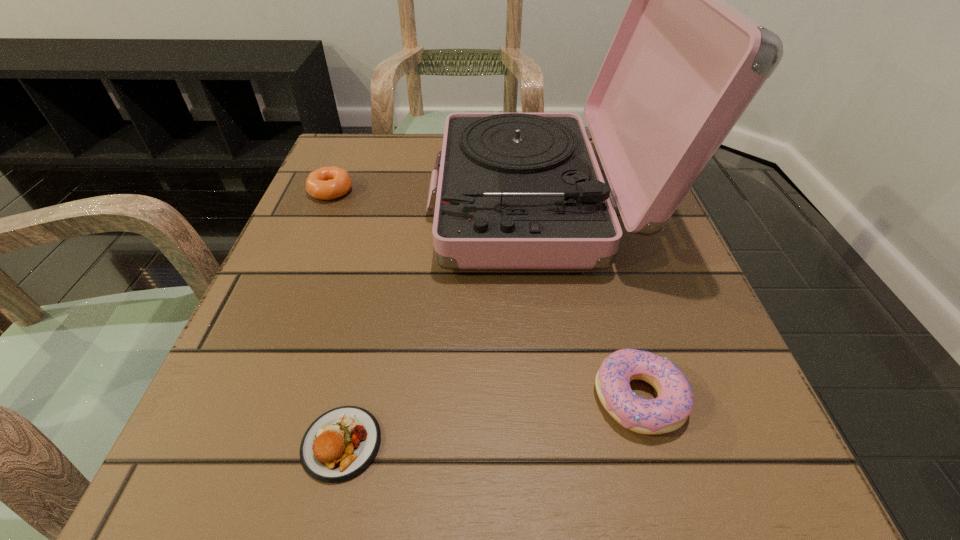
The height and width of the screenshot is (540, 960). I want to click on the tallest object, so click(x=515, y=190).

I want to click on the right doughnut, so click(669, 411).

Locate an element on the screen. The image size is (960, 540). the left doughnut is located at coordinates (327, 183).

I want to click on the farther doughnut, so click(327, 183).

This screenshot has width=960, height=540. I want to click on the third object from right to left, so click(x=340, y=444).

Find the location of `patty (food)`. patty (food) is located at coordinates (340, 444).

This screenshot has width=960, height=540. I want to click on free region located 0.140m with the lid open on the tallest object, so click(359, 202).

Locate an element on the screen. This screenshot has width=960, height=540. vacant space located with the lid open on the tallest object is located at coordinates [314, 202].

You are a GUI agent. You are given a task and a screenshot of the screen. Output one action in this format:
    pyautogui.click(x=<x>, y=<y>)
    Task: Click on the vacant position located 0.130m with the lid open on the tallest object
    
    Given the screenshot: What is the action you would take?
    pyautogui.click(x=364, y=202)

This screenshot has width=960, height=540. Find the location of `vacant position located 0.360m on the left of the nearer doughnut`. vacant position located 0.360m on the left of the nearer doughnut is located at coordinates click(x=320, y=398).